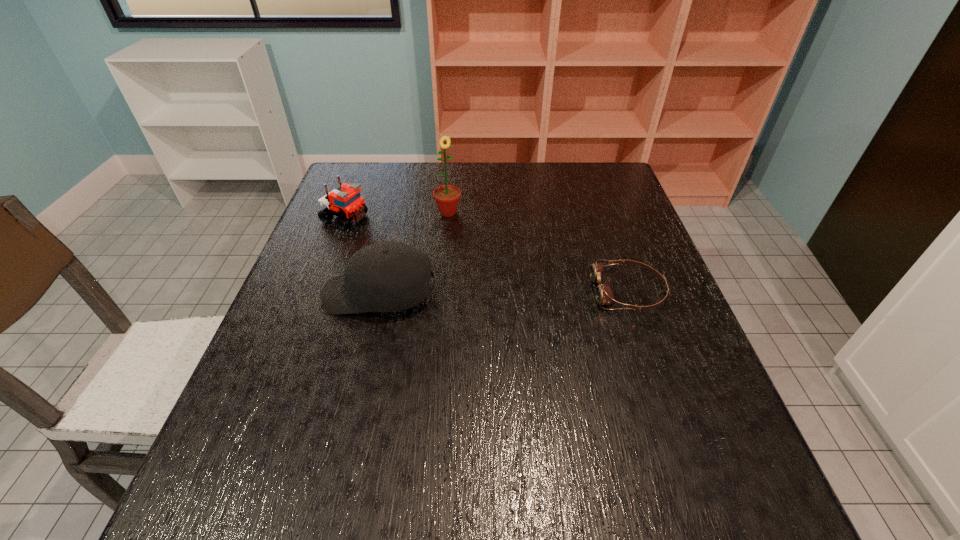
Find the location of a particular element. The height and width of the screenshot is (540, 960). baseball cap is located at coordinates (388, 276).

At what (x,y) coordinates should I click in order to perform the action: click on the shortest object. Please return your answer as a coordinate pair (x, y). The height and width of the screenshot is (540, 960). Looking at the image, I should click on (604, 294).

The width and height of the screenshot is (960, 540). Find the location of `goggles`. goggles is located at coordinates (604, 294).

Where is `the tallest object`? the tallest object is located at coordinates (447, 197).

The image size is (960, 540). In order to click on Lego in this screenshot , I will do `click(347, 204)`.

At what (x,y) coordinates should I click in order to perform the action: click on vacant space situated through the lenses of the shortest object. Please return your answer as a coordinate pair (x, y). Looking at the image, I should click on (470, 292).

Identify the location of vacant space situated 0.240m through the lenses of the shortest object. (492, 292).

Image resolution: width=960 pixels, height=540 pixels. I want to click on free space located through the lenses of the shortest object, so click(432, 292).

At what (x,y) coordinates should I click in order to perform the action: click on vacant position located 0.110m on the face of the sunflower. Please return your answer as a coordinate pair (x, y). Looking at the image, I should click on (463, 243).

Where is `vacant space located on the face of the sunflower`? The image size is (960, 540). vacant space located on the face of the sunflower is located at coordinates (461, 238).